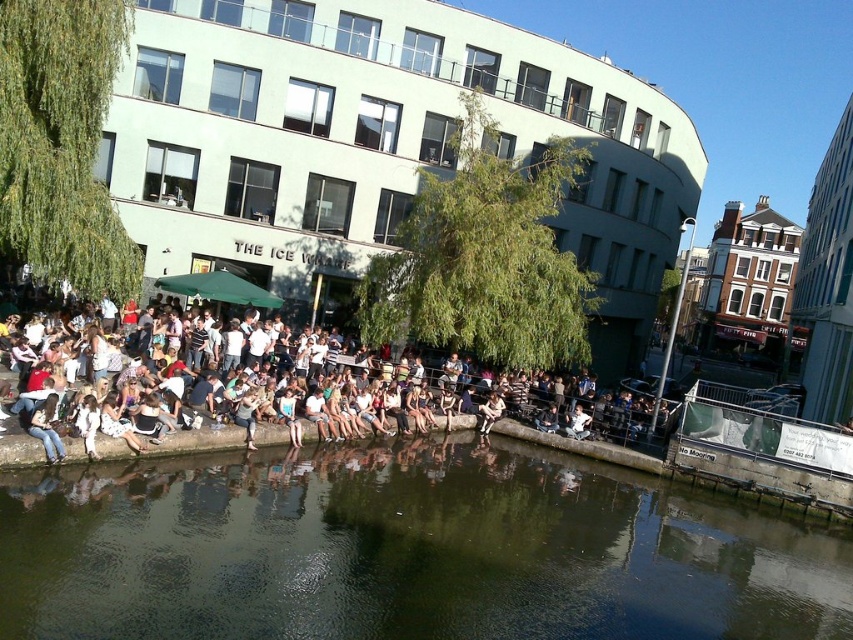
You are a photographer standing at the edge of the canal. You want to capture a photo that includes both the greenish water at lower center and the denim jacket at lower center. Given their sizes, which object should you focus on to ensure both are clearly visible in the frame?

Since the greenish water at lower center is larger than the denim jacket at lower center, you should focus on the greenish water at lower center to ensure both objects are clearly visible in the frame.

You are a delivery drone operator. Your drone needs to fly from the greenish water at lower center to the denim jeans at lower left. What is the minimum horizontal distance your drone must cover?

The minimum horizontal distance your drone must cover is 10.34 meters between the greenish water at lower center and the denim jeans at lower left.

You are standing at the edge of the canal and want to take a photo of both the point at coordinates point (558,474) and point (195,404). Which point should you focus on first to ensure both are in focus?

You should focus on point (558,474) first because it is closer to the camera than point (195,404), ensuring both points will be in focus when using depth of field.